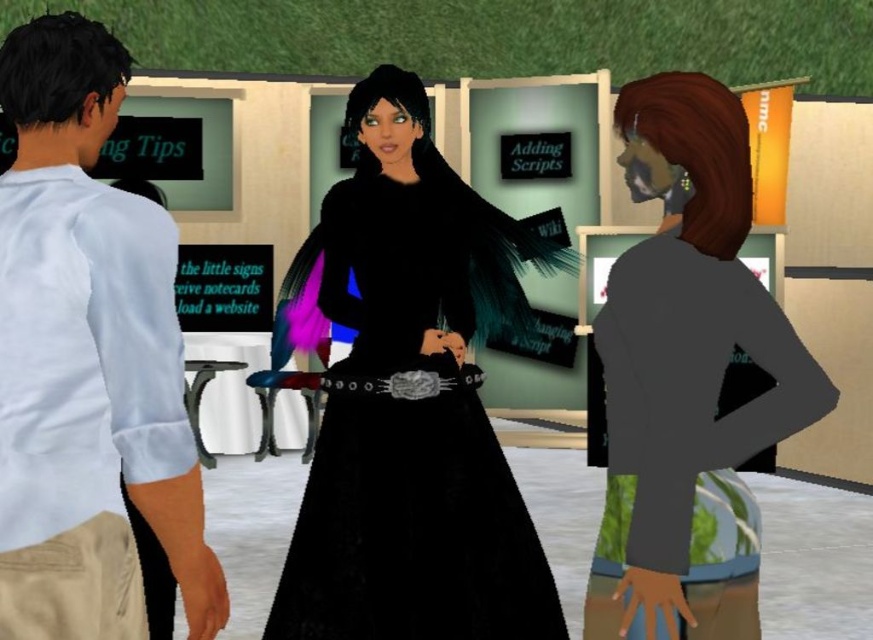
You are a photographer preparing to take a photo of the two central characters. You notice the black velvet dress at center and the silver metallic belt at center. Which one is more likely to be visible in the final photo?

The black velvet dress at center is in front of the silver metallic belt at center, so it will be more visible in the photo.

You are a photographer positioned at the center of the scene. You need to capture a photo that includes both the matte gray jacket at right and the black velvet dress at center. Given the camera you have can only focus on objects within a 5 feet range, will you be able to capture both subjects in focus?

The distance between the matte gray jacket at right and the black velvet dress at center is 6.31 feet, which exceeds the camera focus range of 5 feet. Therefore, both subjects cannot be in focus simultaneously.